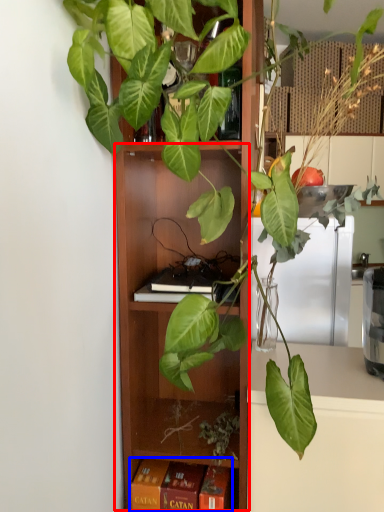
Question: Which object appears closest to the camera in this image, cabinet (highlighted by a red box) or paperback book (highlighted by a blue box)?

Choices:
 (A) cabinet
 (B) paperback book

Answer: (A)